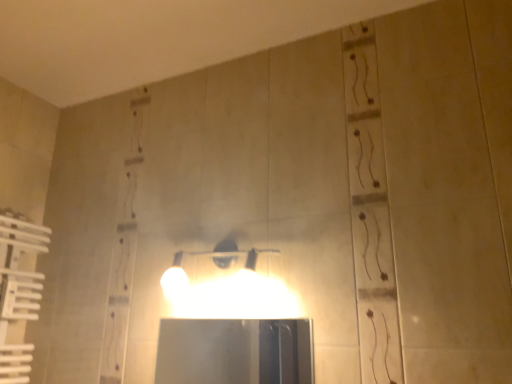
In order to face matte white bulb at center, should I rotate leftwards or rightwards?

Rotate left and turn 5.151 degrees.

This screenshot has width=512, height=384. What do you see at coordinates (213, 257) in the screenshot?
I see `matte white bulb at center` at bounding box center [213, 257].

Find the location of a particular element. This screenshot has width=512, height=384. matte white bulb at center is located at coordinates (213, 257).

Find the location of a particular element. matte white bulb at center is located at coordinates (213, 257).